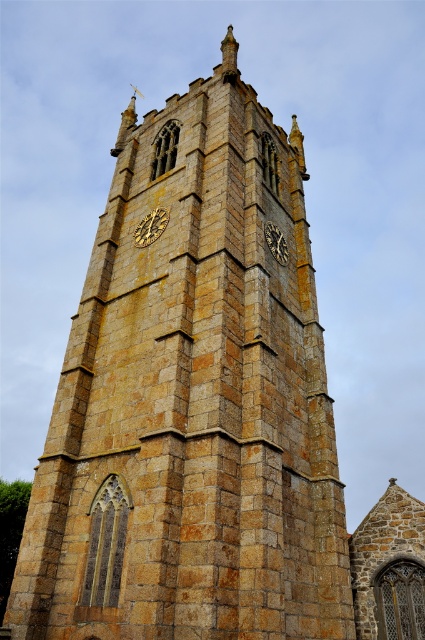
Question: Which object appears closest to the camera in this image?

Choices:
 (A) golden stone clock at center
 (B) gold textured clock at center

Answer: (B)

Question: Considering the relative positions of gold textured clock at center and golden stone clock at center in the image provided, where is gold textured clock at center located with respect to golden stone clock at center?

Choices:
 (A) left
 (B) right

Answer: (A)

Question: Is gold textured clock at center further to the viewer compared to golden stone clock at center?

Choices:
 (A) yes
 (B) no

Answer: (B)

Question: Does gold textured clock at center appear on the right side of golden stone clock at center?

Choices:
 (A) no
 (B) yes

Answer: (A)